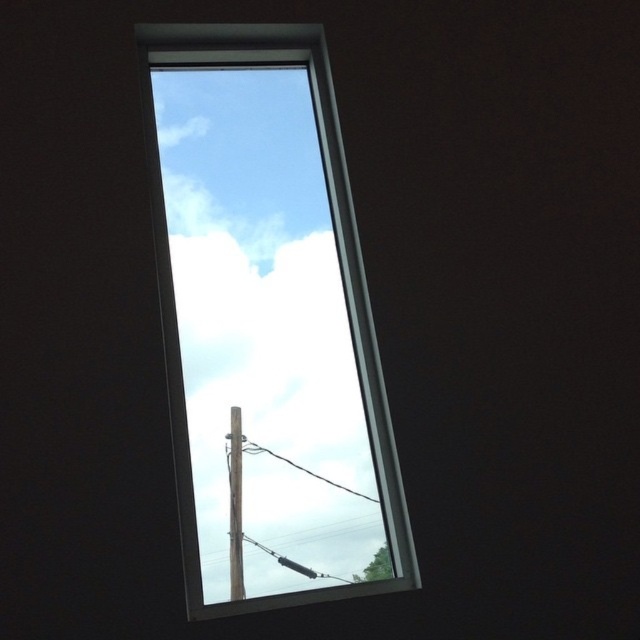
In the scene shown: You are standing inside a room and looking at the transparent glass window at upper center and the smooth metallic pole at center. Which object is positioned to the right side when viewed from your perspective?

The transparent glass window at upper center is to the right of the smooth metallic pole at center.

You are an interior designer planning to install a new decorative element. You have two options to place in the space where the transparent glass window at upper center and the smooth metallic pole at center are located. The first option requires a wider space than the pole, and the second option needs a narrower space. Which option should you choose based on their widths?

The transparent glass window at upper center is wider than the smooth metallic pole at center. Therefore, the first option requiring wider space than the pole should be chosen.

You are a painter standing on a ladder inside a room. You want to paint the smooth metallic pole at center but need to ensure you can reach it without touching the transparent glass window at upper center. Given that your ladder can extend up to 16 inches, will you be able to safely paint the pole?

The distance between the transparent glass window at upper center and the smooth metallic pole at center is 16.68 inches. Since your ladder extends only up to 16 inches, you won measurements, the ladder will not reach the pole without coming into contact with the window. Therefore, you cannot safely paint the pole with the current ladder.